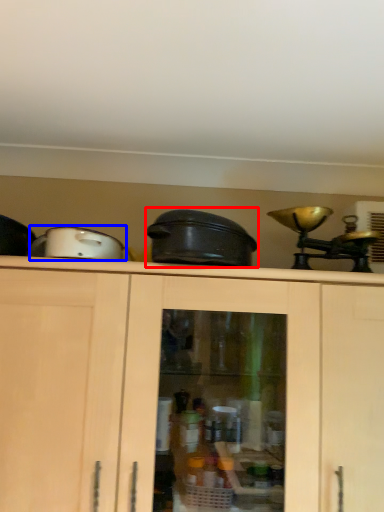
Question: Which object appears farthest to the camera in this image, crock pot (highlighted by a red box) or appliance (highlighted by a blue box)?

Choices:
 (A) crock pot
 (B) appliance

Answer: (A)